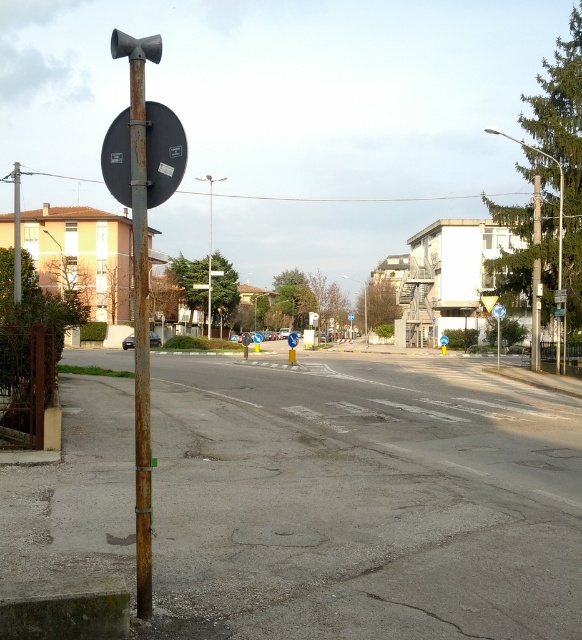
Does metallic pole at right appear on the right side of blue plastic triangle at upper center?

Indeed, metallic pole at right is positioned on the right side of blue plastic triangle at upper center.

Can you confirm if metallic pole at right is thinner than blue plastic triangle at upper center?

Incorrect, metallic pole at right's width is not less than blue plastic triangle at upper center's.

Which is behind, point (540, 273) or point (292, 333)?

The point (540, 273) is behind.

At what (x,y) coordinates should I click in order to perform the action: click on metallic pole at right. Please return your answer as a coordinate pair (x, y). Image resolution: width=582 pixels, height=640 pixels. Looking at the image, I should click on (535, 278).

Who is higher up, rusty metal pole at left or metallic pole at right?

Positioned higher is rusty metal pole at left.

Does rusty metal pole at left have a greater width compared to metallic pole at right?

Correct, the width of rusty metal pole at left exceeds that of metallic pole at right.

Does point (143, 257) come behind point (537, 326)?

No, it is in front of (537, 326).

Identify the location of rusty metal pole at left. coord(140,339).

What are the coordinates of `matte black traffic light at upper left` in the screenshot? It's located at click(x=136, y=45).

Is matte black traffic light at upper left thinner than metallic reflective sign at upper center?

Incorrect, matte black traffic light at upper left's width is not less than metallic reflective sign at upper center's.

Where is `matte black traffic light at upper left`? matte black traffic light at upper left is located at coordinates (136, 45).